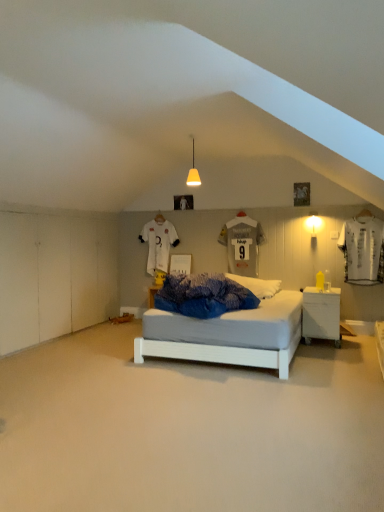
Locate an element on the screen. This screenshot has height=512, width=384. free space above white smooth floor at center (from a real-world perspective) is located at coordinates (161, 392).